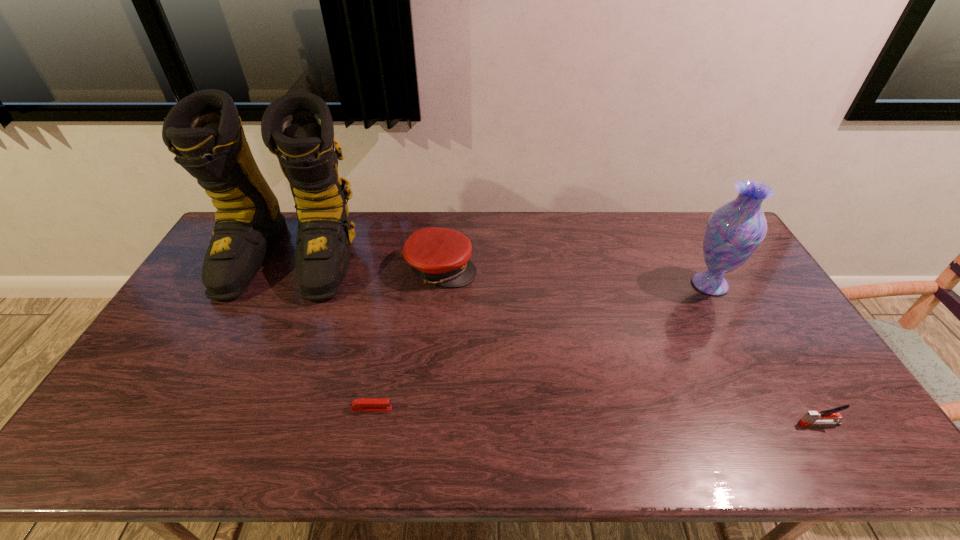
At what (x,y) coordinates should I click in order to perform the action: click on empty location between the right stapler and the left stapler. Please return your answer as a coordinate pair (x, y). The height and width of the screenshot is (540, 960). Looking at the image, I should click on [x=595, y=416].

What are the coordinates of `vacant region between the cap and the vase` in the screenshot? It's located at (575, 276).

The width and height of the screenshot is (960, 540). Find the location of `free space between the cap and the farther stapler`. free space between the cap and the farther stapler is located at coordinates (407, 339).

The height and width of the screenshot is (540, 960). I want to click on vacant area that lies between the tallest object and the second nearest object, so (331, 334).

This screenshot has height=540, width=960. What are the coordinates of `vacant area that lies between the farther stapler and the cap` in the screenshot? It's located at (407, 339).

What are the coordinates of `object that stands as the closest to the vase` in the screenshot? It's located at (828, 417).

Point out which object is positioned as the third nearest to the third tallest object. Please provide its 2D coordinates. Your answer should be formatted as a tuple, i.e. [(x, y)], where the tuple contains the x and y coordinates of a point satisfying the conditions above.

[(734, 231)]

Identify the location of vacant position in the image that satisfies the following two spatial constraints: 1. on the front of the cap with an emblem; 2. on the left side of the fourth shortest object. This screenshot has height=540, width=960. (440, 284).